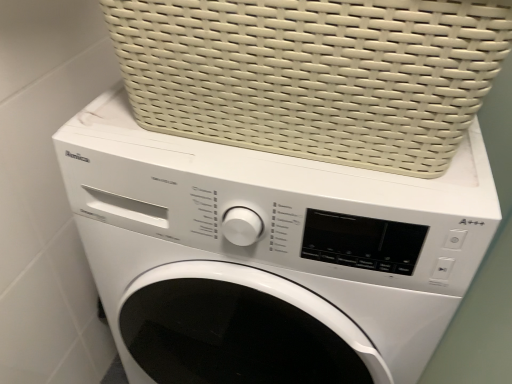
Question: From a real-world perspective, is white glossy washing machine at center positioned under white woven basket at upper center based on gravity?

Choices:
 (A) no
 (B) yes

Answer: (B)

Question: Could white woven basket at upper center be considered to be inside white glossy washing machine at center?

Choices:
 (A) no
 (B) yes

Answer: (A)

Question: Would you consider white glossy washing machine at center to be distant from white woven basket at upper center?

Choices:
 (A) no
 (B) yes

Answer: (A)

Question: Considering the relative sizes of white glossy washing machine at center and white woven basket at upper center in the image provided, is white glossy washing machine at center bigger than white woven basket at upper center?

Choices:
 (A) no
 (B) yes

Answer: (B)

Question: Is white glossy washing machine at center to the right of white woven basket at upper center from the viewer's perspective?

Choices:
 (A) no
 (B) yes

Answer: (A)

Question: Is white glossy washing machine at center wider than white woven basket at upper center?

Choices:
 (A) no
 (B) yes

Answer: (B)

Question: Does white woven basket at upper center come behind white glossy washing machine at center?

Choices:
 (A) no
 (B) yes

Answer: (A)

Question: Does white woven basket at upper center appear on the right side of white glossy washing machine at center?

Choices:
 (A) yes
 (B) no

Answer: (A)

Question: From a real-world perspective, is white woven basket at upper center physically above white glossy washing machine at center?

Choices:
 (A) no
 (B) yes

Answer: (B)

Question: Is white woven basket at upper center turned away from white glossy washing machine at center?

Choices:
 (A) no
 (B) yes

Answer: (A)

Question: Does white woven basket at upper center appear on the left side of white glossy washing machine at center?

Choices:
 (A) yes
 (B) no

Answer: (B)

Question: Is white woven basket at upper center shorter than white glossy washing machine at center?

Choices:
 (A) yes
 (B) no

Answer: (A)

Question: Is white glossy washing machine at center situated inside white woven basket at upper center or outside?

Choices:
 (A) outside
 (B) inside

Answer: (A)